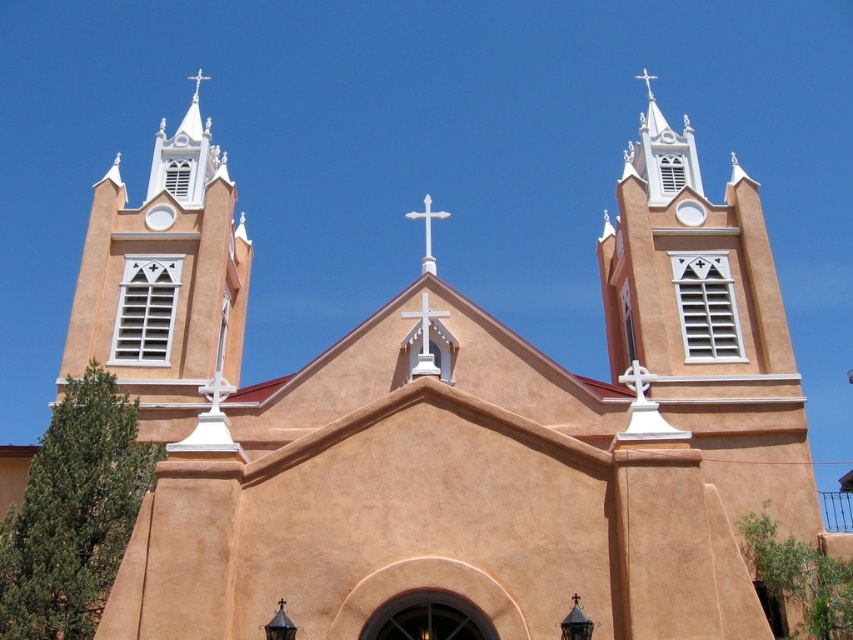
Who is higher up, white stucco tower at upper left or white matte cross at center?

white stucco tower at upper left is higher up.

Which is below, white stucco tower at upper left or white matte cross at center?

white matte cross at center is lower down.

Who is more forward, (107, 220) or (431, 372)?

Point (431, 372) is more forward.

I want to click on white stucco tower at upper left, so click(x=164, y=272).